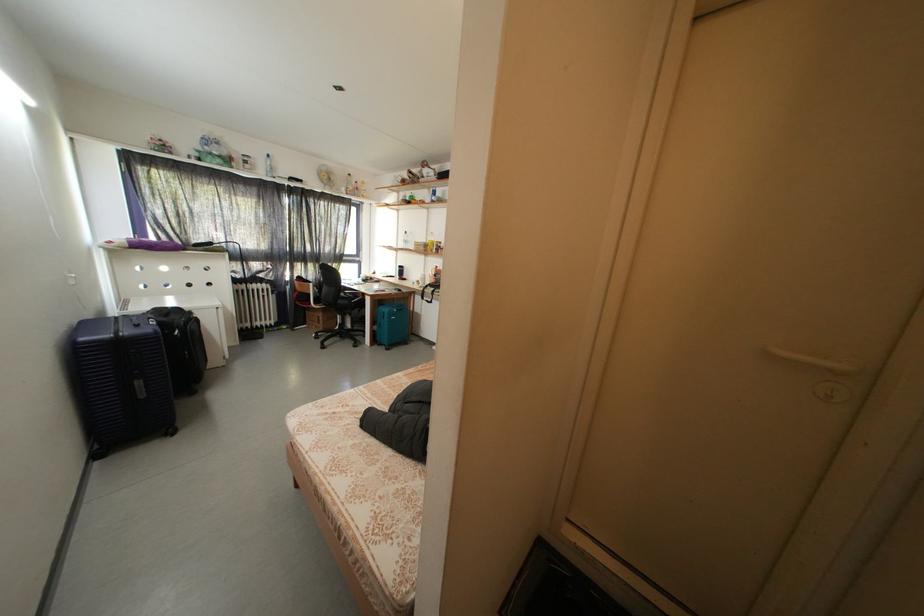
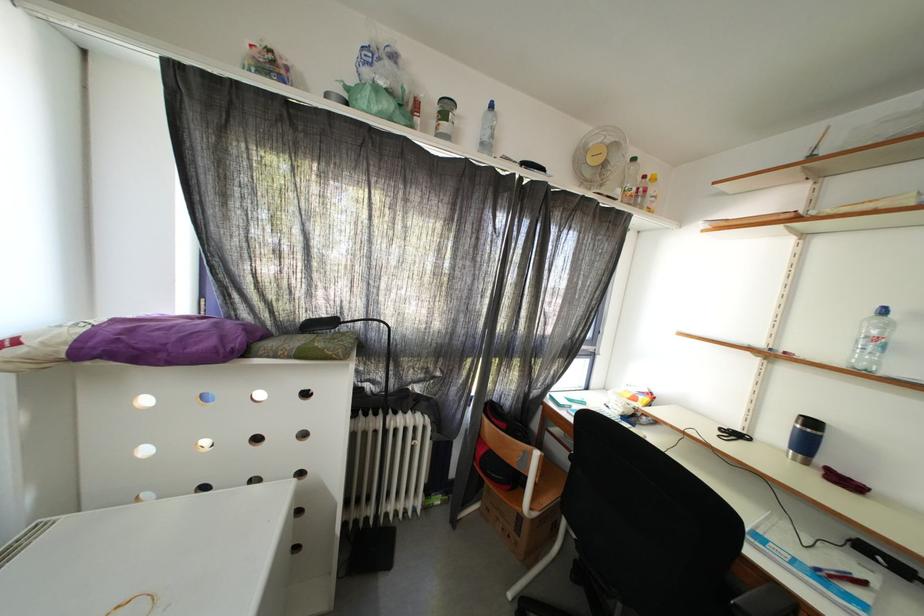
In a continuous first-person perspective shot, in which direction is the camera moving?

The movement direction of the cameraman is left, forward.